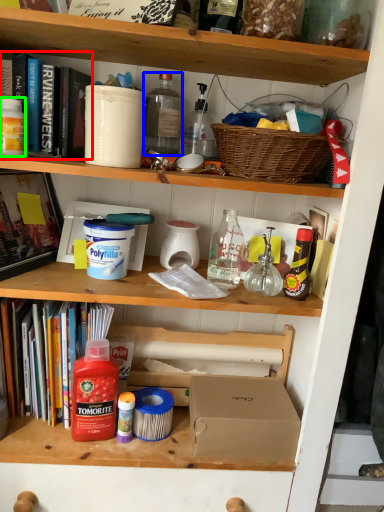
Question: Which is nearer to the book (highlighted by a red box)? bottle (highlighted by a blue box) or bucket (highlighted by a green box).

Choices:
 (A) bottle
 (B) bucket

Answer: (B)